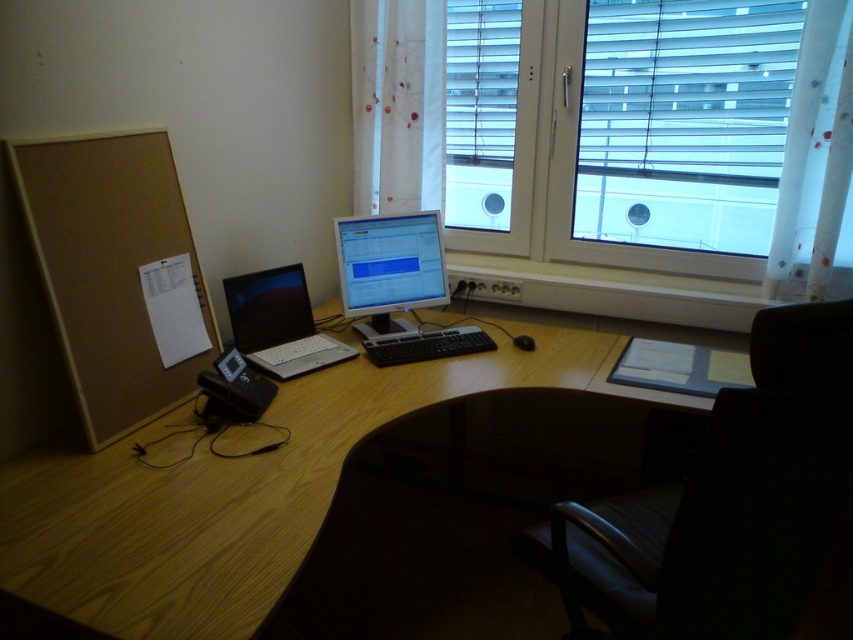
Question: Which point is closer to the camera?

Choices:
 (A) (432, 355)
 (B) (262, 369)

Answer: (B)

Question: Is satin silver laptop at left closer to camera compared to black matte mouse at center?

Choices:
 (A) no
 (B) yes

Answer: (B)

Question: Does wooden at center lie behind black plastic keyboard at center?

Choices:
 (A) yes
 (B) no

Answer: (B)

Question: Based on their relative distances, which object is farther from the wooden at center?

Choices:
 (A) black matte mouse at center
 (B) black plastic keyboard at center
 (C) matte silver monitor at center

Answer: (A)

Question: Can you confirm if wooden at center is thinner than matte silver monitor at center?

Choices:
 (A) yes
 (B) no

Answer: (B)

Question: Considering the real-world distances, which object is farthest from the black leather swivel chair at lower right?

Choices:
 (A) satin silver laptop at left
 (B) black matte mouse at center
 (C) wooden at center

Answer: (A)